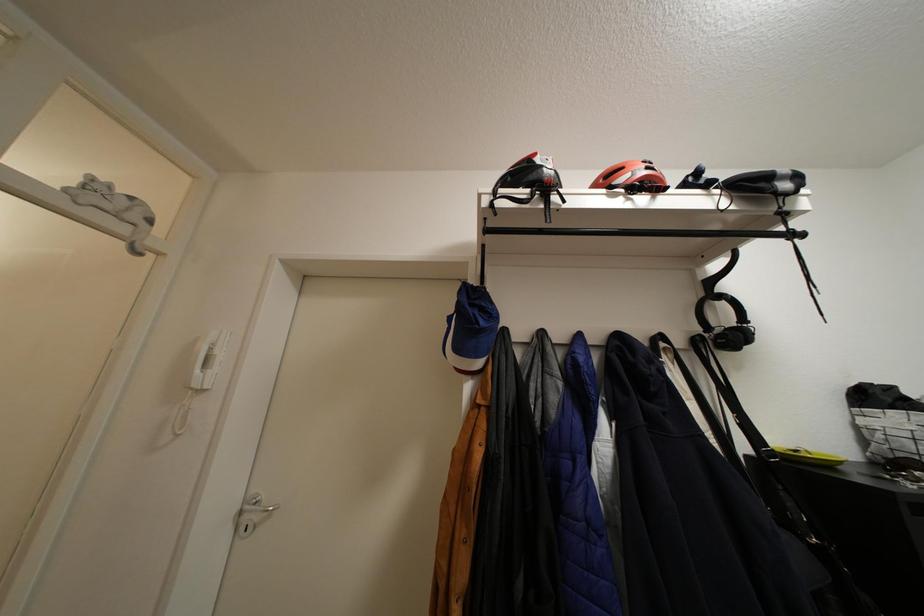
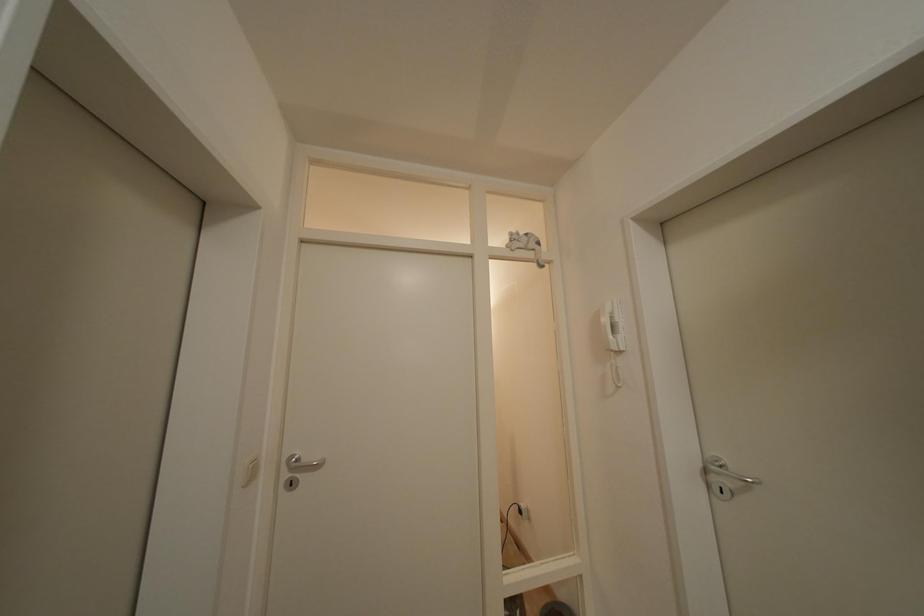
Question: The images are taken continuously from a first-person perspective. In which direction is your viewpoint rotating?

Choices:
 (A) Left
 (B) Right
 (C) Up
 (D) Down

Answer: (A)